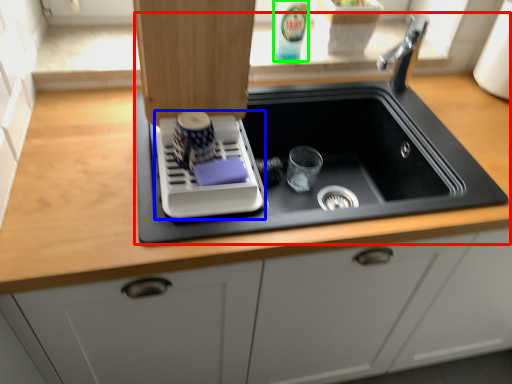
Question: Considering the real-world distances, which object is closest to sink (highlighted by a red box)? appliance (highlighted by a blue box) or beverage (highlighted by a green box).

Choices:
 (A) appliance
 (B) beverage

Answer: (A)